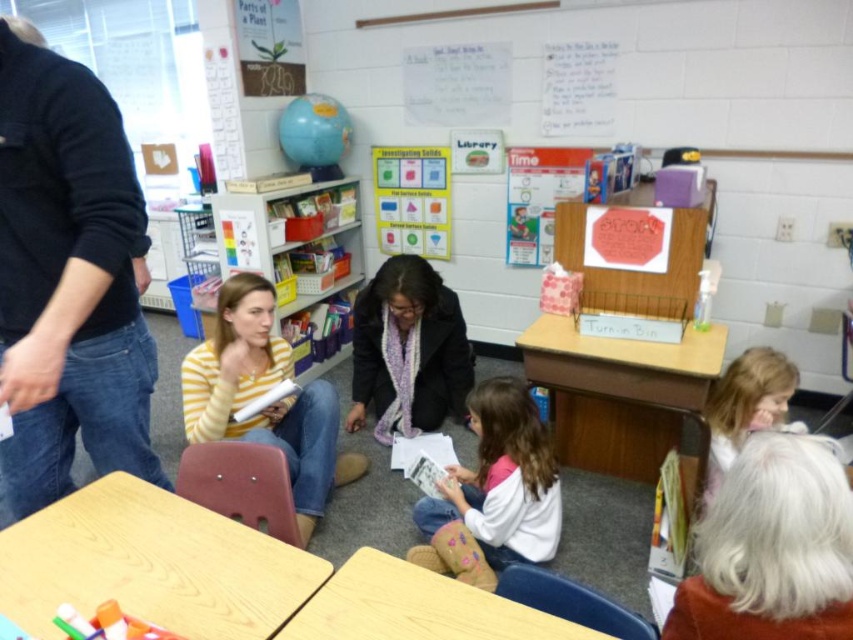
Question: Is black cotton shirt at upper left wider than wooden table at lower left?

Choices:
 (A) yes
 (B) no

Answer: (B)

Question: From the image, what is the correct spatial relationship of wooden table at lower left in relation to yellow striped sweater at center?

Choices:
 (A) right
 (B) left

Answer: (B)

Question: Which of the following is the closest to the observer?

Choices:
 (A) white soft sweater at lower center
 (B) wooden table at lower center
 (C) blonde hair at lower right
 (D) wooden at center

Answer: (B)

Question: Which point is farther to the camera?

Choices:
 (A) wooden at center
 (B) yellow striped sweater at center
 (C) blonde hair at lower right

Answer: (B)

Question: Which point is closer to the camera?

Choices:
 (A) yellow striped sweater at center
 (B) wooden table at lower left
 (C) wooden table at lower center
 (D) white soft sweater at lower center

Answer: (B)

Question: Is purple scarf at center further to camera compared to wooden table at lower center?

Choices:
 (A) yes
 (B) no

Answer: (A)